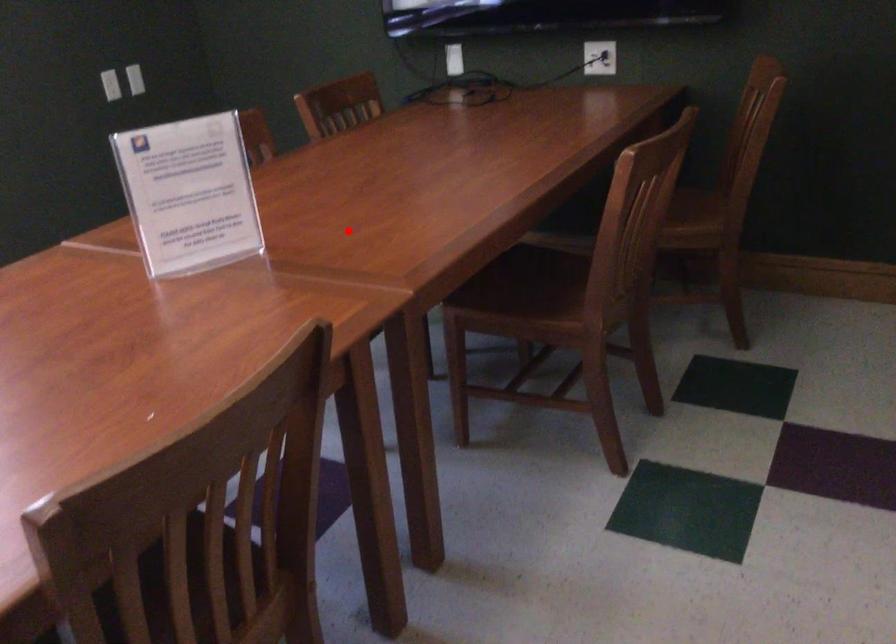
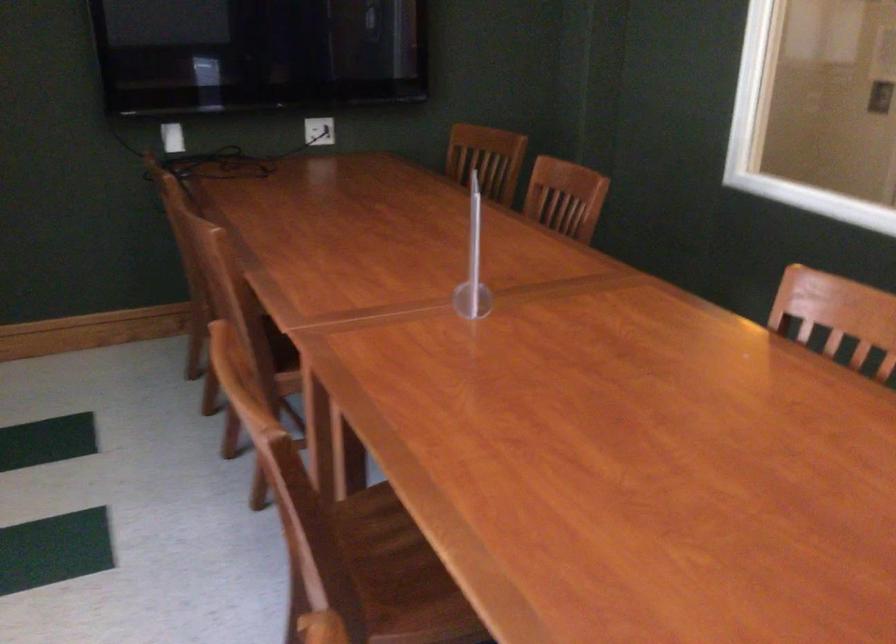
Where in the second image is the point corresponding to the highlighted location from the first image?

(472, 263)